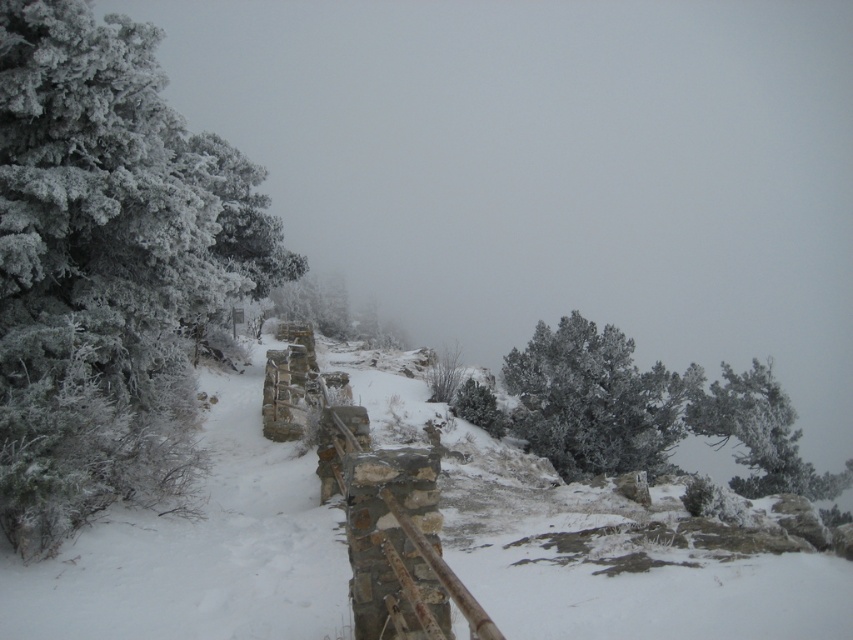
Consider the image. Who is more distant from viewer, (614, 632) or (746, 481)?

Positioned behind is point (746, 481).

Between white frosty snow at center and white frosty tree at upper right, which one has less height?

With less height is white frosty snow at center.

What do you see at coordinates (415, 547) in the screenshot? I see `white frosty snow at center` at bounding box center [415, 547].

Locate an element on the screen. The height and width of the screenshot is (640, 853). white frosty snow at center is located at coordinates coord(415,547).

Is frosted pine tree at upper center taller than white frosty tree at upper right?

Incorrect, frosted pine tree at upper center's height is not larger of white frosty tree at upper right's.

Between point (611, 330) and point (786, 397), which one is positioned in front?

Point (786, 397)

At what (x,y) coordinates should I click in order to perform the action: click on frosted pine tree at upper center. Please return your answer as a coordinate pair (x, y). Looking at the image, I should click on (595, 401).

Where is `frosted pine tree at upper center`? This screenshot has width=853, height=640. frosted pine tree at upper center is located at coordinates tap(595, 401).

Between frosted evergreen at left and frosted pine tree at upper center, which one has less height?

With less height is frosted pine tree at upper center.

Does frosted evergreen at left have a lesser width compared to frosted pine tree at upper center?

Yes.

I want to click on frosted evergreen at left, so click(108, 268).